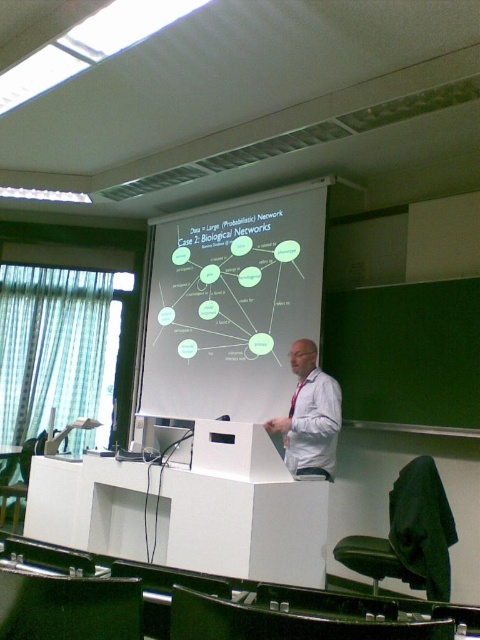
You are a student sitting in the front row of the classroom. You notice the white matte podium at center and the white shirt at center. Which object is positioned lower in the image?

The white matte podium at center is located below the white shirt at center, so it is positioned lower in the image.